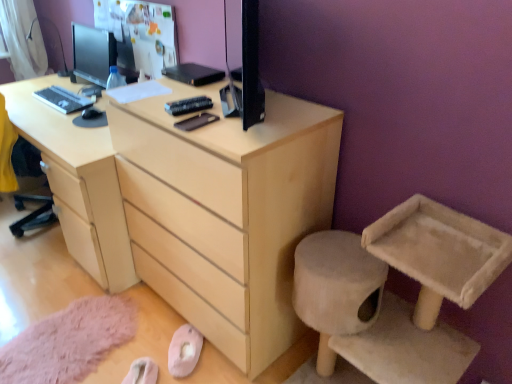
This screenshot has height=384, width=512. What are the coordinates of `beige fabric cat tree at lower right` in the screenshot? It's located at (370, 316).

What do you see at coordinates (88, 53) in the screenshot? I see `matte black monitor at upper left` at bounding box center [88, 53].

The width and height of the screenshot is (512, 384). Identify the location of matte black monitor at upper left. (88, 53).

Where is `matte black keyboard at left`? The height and width of the screenshot is (384, 512). matte black keyboard at left is located at coordinates (63, 99).

Considering the sizes of matte black monitor at upper left and beige fabric cat tree at lower right in the image, is matte black monitor at upper left bigger or smaller than beige fabric cat tree at lower right?

matte black monitor at upper left is smaller than beige fabric cat tree at lower right.

Does matte black monitor at upper left lie behind beige fabric cat tree at lower right?

Yes, matte black monitor at upper left is behind beige fabric cat tree at lower right.

From their relative heights in the image, would you say matte black monitor at upper left is taller or shorter than beige fabric cat tree at lower right?

Clearly, matte black monitor at upper left is shorter compared to beige fabric cat tree at lower right.

Considering the points (93, 33) and (359, 282), which point is behind, point (93, 33) or point (359, 282)?

The point (93, 33) is farther.

Is beige fabric cat tree at lower right oriented away from matte black keyboard at left?

That's not correct — beige fabric cat tree at lower right is not looking away from matte black keyboard at left.

Does beige fabric cat tree at lower right have a greater width compared to matte black keyboard at left?

Indeed, beige fabric cat tree at lower right has a greater width compared to matte black keyboard at left.

Which is more to the right, beige fabric cat tree at lower right or matte black keyboard at left?

beige fabric cat tree at lower right.

Which object is further away from the camera taking this photo, beige fabric cat tree at lower right or matte black keyboard at left?

matte black keyboard at left is more distant.

From the image's perspective, is matte black keyboard at left under beige fabric cat tree at lower right?

No, from the image's perspective, matte black keyboard at left is not beneath beige fabric cat tree at lower right.

Is matte black keyboard at left not inside beige fabric cat tree at lower right?

Yes, matte black keyboard at left is located beyond the bounds of beige fabric cat tree at lower right.

From a real-world perspective, between matte black keyboard at left and beige fabric cat tree at lower right, who is vertically higher?

From a 3D spatial view, matte black keyboard at left is above.

Is light wood desk at center thinner than matte black keyboard at left?

Incorrect, the width of light wood desk at center is not less than that of matte black keyboard at left.

Can you tell me how much light wood desk at center and matte black keyboard at left differ in facing direction?

They differ by 0.0606 degrees in their facing directions.

Which of these two, light wood desk at center or matte black keyboard at left, stands shorter?

matte black keyboard at left.

Does light wood desk at center turn towards matte black keyboard at left?

No, light wood desk at center is not oriented towards matte black keyboard at left.

Is matte black monitor at upper left inside matte black keyboard at left?

That's incorrect, matte black monitor at upper left is not inside matte black keyboard at left.

From the image's perspective, which object appears higher, matte black keyboard at left or matte black monitor at upper left?

matte black monitor at upper left is shown above in the image.

Could you tell me if matte black keyboard at left is turned towards matte black monitor at upper left?

No.

Is matte black keyboard at left far from matte black monitor at upper left?

No, matte black keyboard at left is not far from matte black monitor at upper left.

Does beige fabric cat tree at lower right lie in front of matte black monitor at upper left?

Yes.

Is beige fabric cat tree at lower right situated inside matte black monitor at upper left or outside?

beige fabric cat tree at lower right lies outside matte black monitor at upper left.

Is beige fabric cat tree at lower right to the left or to the right of matte black monitor at upper left in the image?

Based on their positions, beige fabric cat tree at lower right is located to the right of matte black monitor at upper left.

Between beige fabric cat tree at lower right and matte black monitor at upper left, which one has smaller size?

Smaller between the two is matte black monitor at upper left.

Which of these two, beige fabric cat tree at lower right or light wood desk at center, is bigger?

light wood desk at center is bigger.

From the picture: Is beige fabric cat tree at lower right in front of or behind light wood desk at center in the image?

In the image, beige fabric cat tree at lower right appears in front of light wood desk at center.

How distant is beige fabric cat tree at lower right from light wood desk at center?

1.18 meters.

What are the coordinates of `desktop computer behind the beige fabric cat tree at lower right` in the screenshot? It's located at (88, 53).

Locate an element on the screen. The width and height of the screenshot is (512, 384). furniture that is under the matte black keyboard at left (from a real-world perspective) is located at coordinates (370, 316).

Considering their positions, is matte black keyboard at left positioned closer to matte black monitor at upper left than beige fabric cat tree at lower right?

The object closer to matte black monitor at upper left is matte black keyboard at left.

Based on their spatial positions, is light wood desk at center or beige fabric cat tree at lower right closer to light wood chest of drawers at center?

Based on the image, light wood desk at center appears to be nearer to light wood chest of drawers at center.

When comparing their distances from beige fabric cat tree at lower right, does light wood desk at center or light wood chest of drawers at center seem closer?

Among the two, light wood chest of drawers at center is located nearer to beige fabric cat tree at lower right.

Considering their positions, is light wood chest of drawers at center positioned further to matte black monitor at upper left than beige fabric cat tree at lower right?

beige fabric cat tree at lower right lies further to matte black monitor at upper left than the other object.

Which object lies further to the anchor point light wood chest of drawers at center, beige fabric cat tree at lower right or matte black monitor at upper left?

matte black monitor at upper left.

From the image, which object appears to be nearer to light wood desk at center, light wood chest of drawers at center or matte black keyboard at left?

Among the two, light wood chest of drawers at center is located nearer to light wood desk at center.

When comparing their distances from light wood desk at center, does matte black keyboard at left or matte black monitor at upper left seem closer?

matte black keyboard at left is closer to light wood desk at center.

When comparing their distances from light wood chest of drawers at center, does matte black monitor at upper left or light wood desk at center seem closer?

Among the two, light wood desk at center is located nearer to light wood chest of drawers at center.

In order to click on desktop that lies between matte black monitor at upper left and light wood desk at center from top to bottom in this screenshot , I will do `click(63, 99)`.

Identify the location of chest of drawers between matte black monitor at upper left and beige fabric cat tree at lower right. pyautogui.click(x=197, y=206).

This screenshot has height=384, width=512. I want to click on chest of drawers between light wood desk at center and beige fabric cat tree at lower right from left to right, so click(x=197, y=206).

The height and width of the screenshot is (384, 512). I want to click on desktop computer between light wood chest of drawers at center and matte black keyboard at left along the z-axis, so click(88, 53).